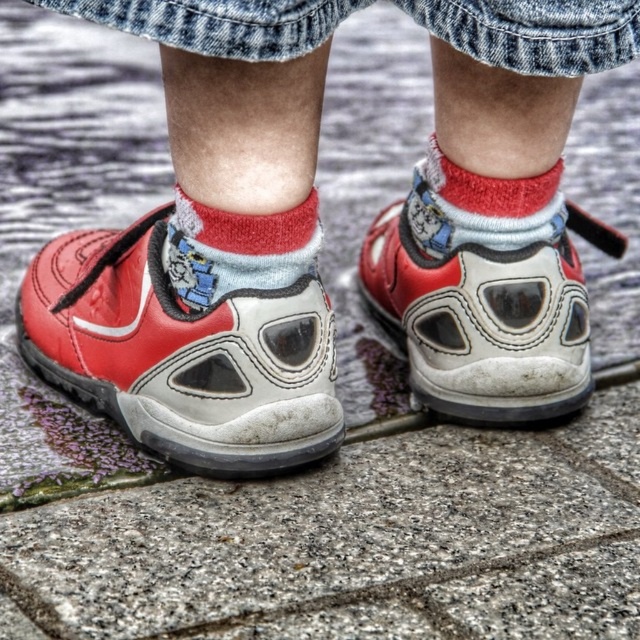
Between knitted wool sock at center and red cotton sock at center, which one has less height?

knitted wool sock at center is shorter.

Does knitted wool sock at center have a lesser width compared to red cotton sock at center?

Yes.

Which is in front, point (227, 292) or point (456, 168)?

Point (227, 292) is in front.

Locate an element on the screen. knitted wool sock at center is located at coordinates (236, 250).

Between point (220, 445) and point (193, 284), which one is positioned in front?

Point (220, 445) is more forward.

Image resolution: width=640 pixels, height=640 pixels. What do you see at coordinates (208, 250) in the screenshot?
I see `matte leather shoes at center` at bounding box center [208, 250].

Is point (534, 371) in front of point (260, 221)?

No, it is not.

I want to click on matte leather shoes at center, so click(x=208, y=250).

Between white leather shoe at center and red cotton sock at center, which one has more height?

white leather shoe at center

Is white leather shoe at center below red cotton sock at center?

Indeed, white leather shoe at center is positioned under red cotton sock at center.

The width and height of the screenshot is (640, 640). Describe the element at coordinates (484, 304) in the screenshot. I see `white leather shoe at center` at that location.

Locate an element on the screen. This screenshot has height=640, width=640. white leather shoe at center is located at coordinates (484, 304).